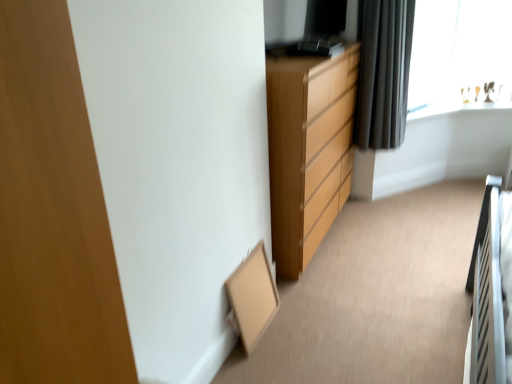
Question: Is black fabric curtain at upper right to the left or to the right of transparent glass window at upper right in the image?

Choices:
 (A) left
 (B) right

Answer: (A)

Question: Is black fabric curtain at upper right in front of or behind transparent glass window at upper right in the image?

Choices:
 (A) front
 (B) behind

Answer: (A)

Question: Estimate the real-world distances between objects in this image. Which object is farther from the transparent glass window at upper right?

Choices:
 (A) matte wood chest of drawers at center
 (B) black fabric curtain at upper right

Answer: (A)

Question: Estimate the real-world distances between objects in this image. Which object is closer to the black fabric curtain at upper right?

Choices:
 (A) matte wood chest of drawers at center
 (B) transparent glass window at upper right

Answer: (A)